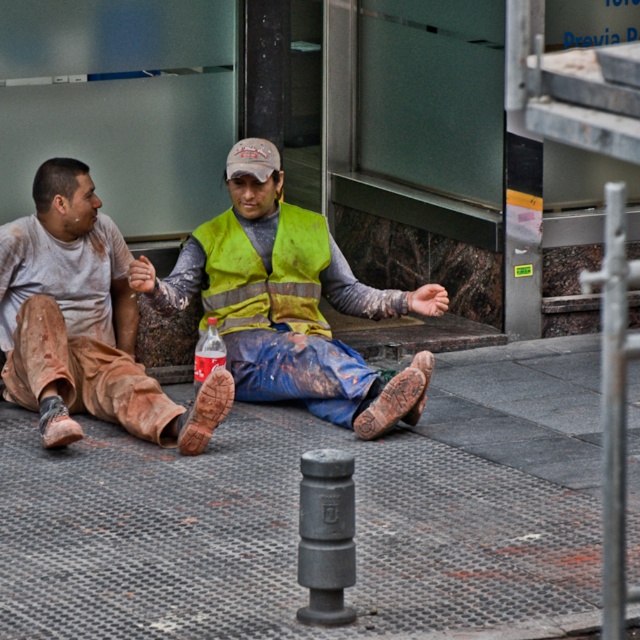
You are a delivery person trying to place a package on the gray rubber mat at center. However, there is a green reflective safety vest at center in the way. Can you place the package on the mat without moving the vest?

The gray rubber mat at center is located below the green reflective safety vest at center, so the vest is covering the mat. Therefore, you cannot place the package on the mat without moving the vest.